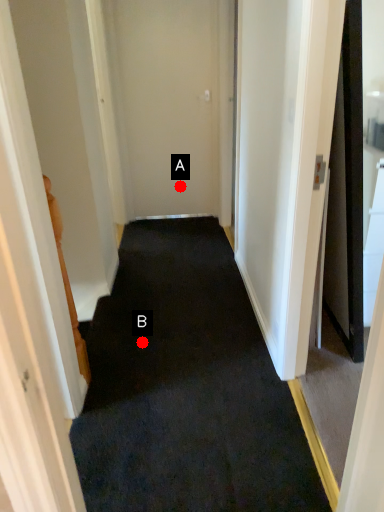
Question: Two points are circled on the image, labeled by A and B beside each circle. Which point is farther to the camera?

Choices:
 (A) A is further
 (B) B is further

Answer: (A)